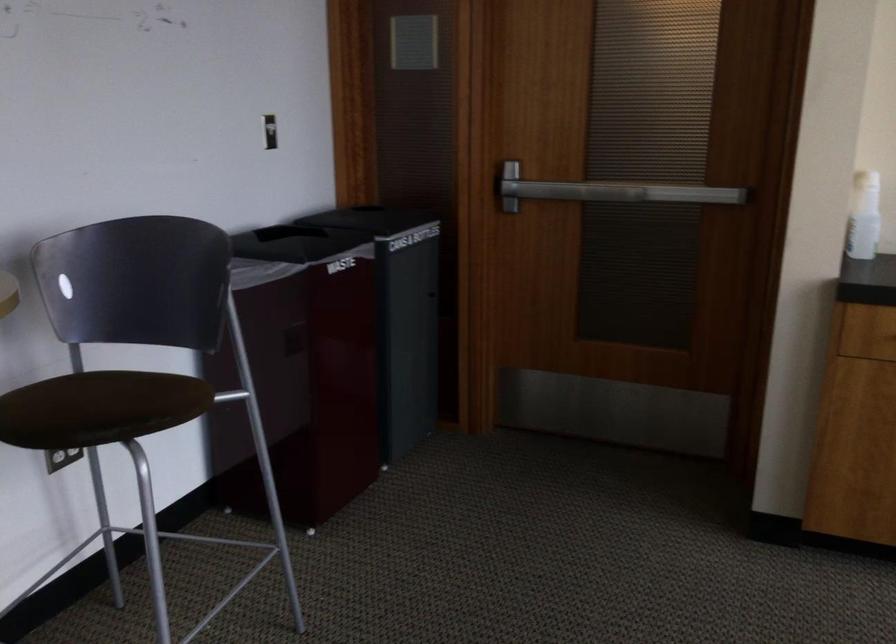
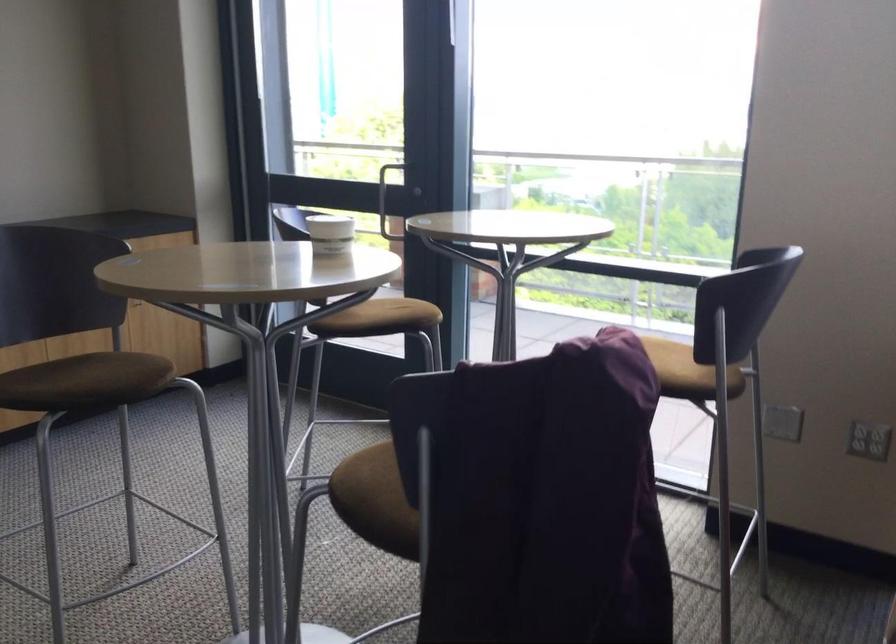
Question: The images are taken continuously from a first-person perspective. In which direction is your viewpoint rotating?

Choices:
 (A) Left
 (B) Right
 (C) Up
 (D) Down

Answer: (B)